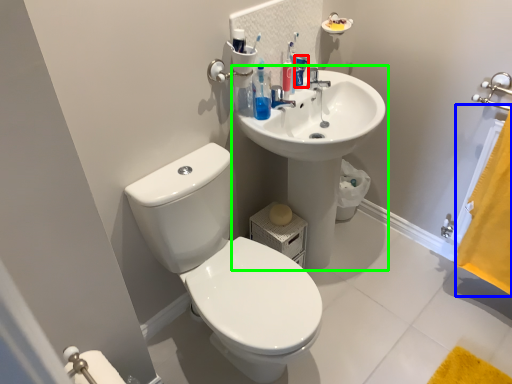
Question: Which object is positioned farthest from toiletry (highlighted by a red box)? Select from curtain (highlighted by a blue box) and sink (highlighted by a green box).

Choices:
 (A) curtain
 (B) sink

Answer: (A)